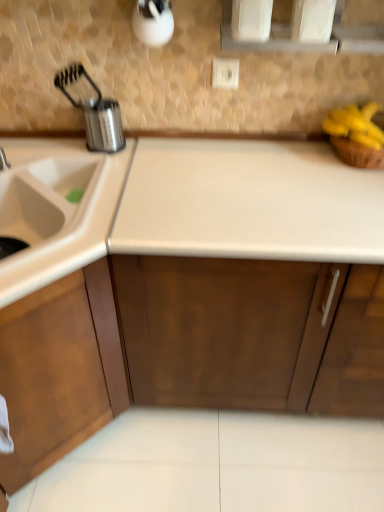
I want to click on free space in front of metallic silver canister at upper left, so click(x=92, y=166).